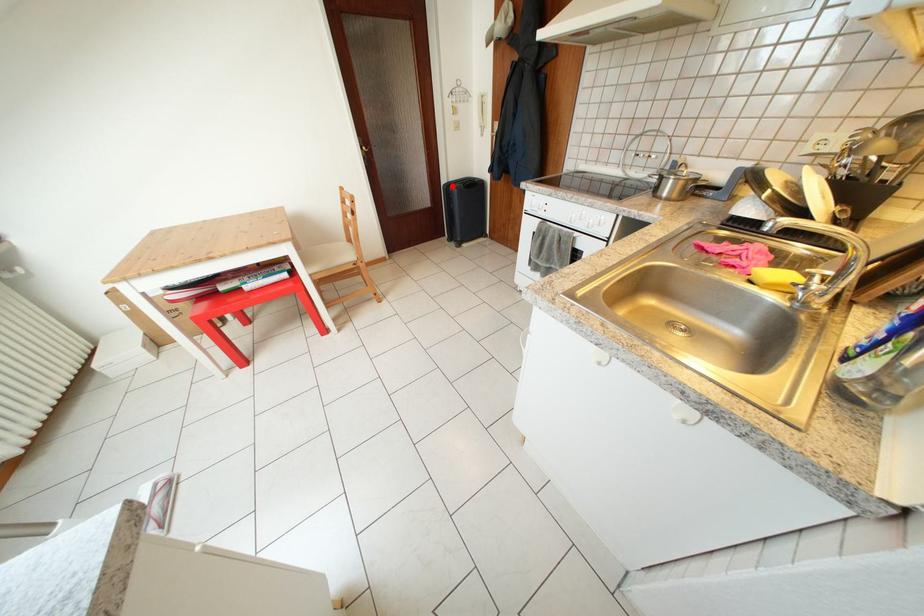
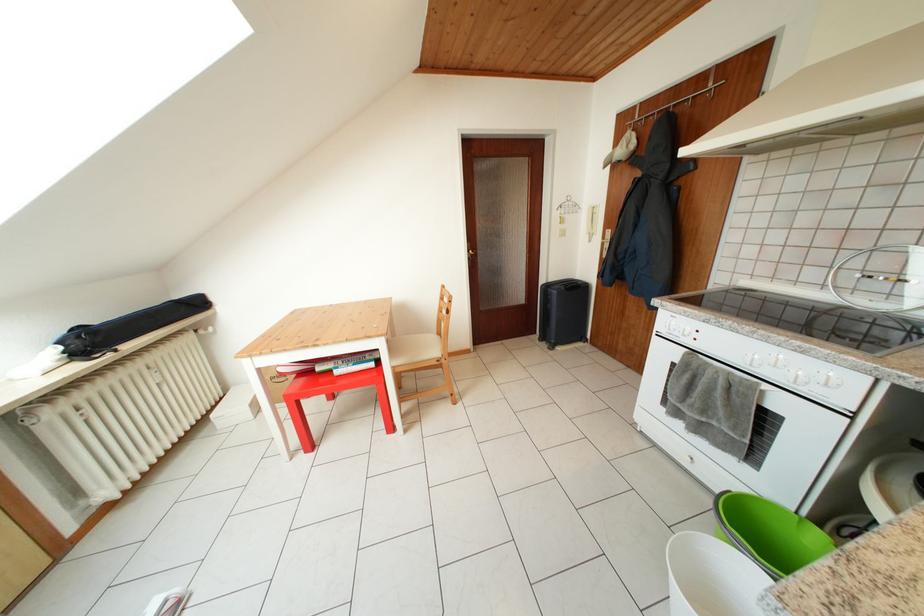
Question: I am providing you with two images of the same scene from different viewpoints. Image1 has a red point marked. In image2, the corresponding 3D location appears at what relative position? Reply with the corresponding letter.

Choices:
 (A) Closer
 (B) Farther

Answer: (A)